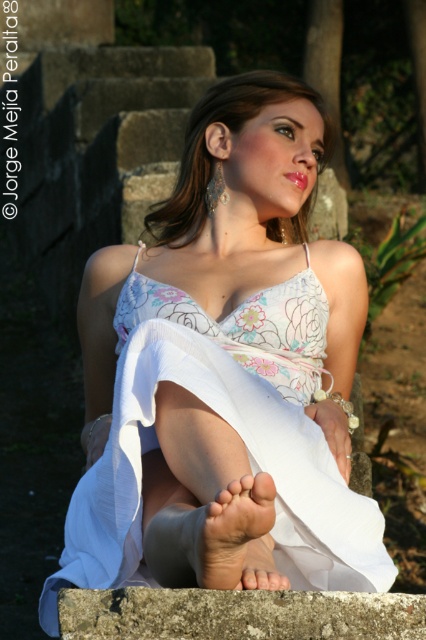
Is gray rough concrete at lower center bigger than dry skin foot at lower center?

No, gray rough concrete at lower center is not bigger than dry skin foot at lower center.

Who is higher up, gray rough concrete at lower center or dry skin foot at lower center?

dry skin foot at lower center is higher up.

Does point (187, 637) lie behind point (238, 552)?

No.

The height and width of the screenshot is (640, 426). Identify the location of gray rough concrete at lower center. (238, 614).

Who is taller, gray rough concrete at lower center or glossy pink lipstick at center?

With more height is gray rough concrete at lower center.

Who is positioned more to the right, gray rough concrete at lower center or glossy pink lipstick at center?

From the viewer's perspective, glossy pink lipstick at center appears more on the right side.

Where is `gray rough concrete at lower center`? The image size is (426, 640). gray rough concrete at lower center is located at coordinates (238, 614).

Locate an element on the screen. The image size is (426, 640). gray rough concrete at lower center is located at coordinates (238, 614).

Does white sheer dress at center have a greater width compared to glossy pink lipstick at center?

Yes.

Between point (201, 385) and point (302, 182), which one is positioned behind?

The point (302, 182) is more distant.

You are a GUI agent. You are given a task and a screenshot of the screen. Output one action in this format:
    pyautogui.click(x=<x>, y=<y>)
    Task: Click on the white sheer dress at center
    This screenshot has height=640, width=426.
    Given the screenshot: What is the action you would take?
    pyautogui.click(x=224, y=372)